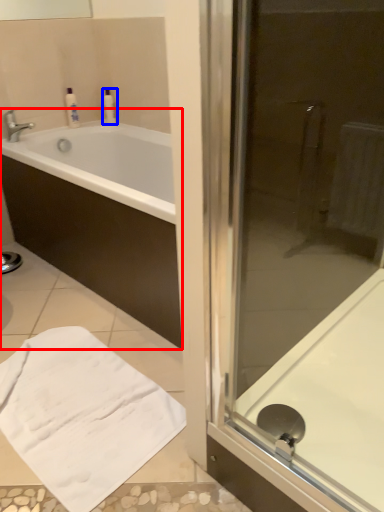
Question: Which object appears farthest to the camera in this image, bathtub (highlighted by a red box) or toiletry (highlighted by a blue box)?

Choices:
 (A) bathtub
 (B) toiletry

Answer: (B)